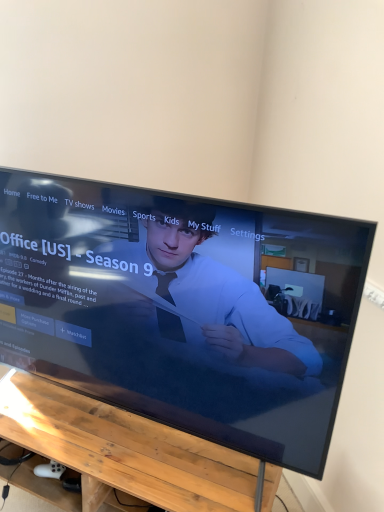
Question: Should I look upward or downward to see wooden table at lower center?

Choices:
 (A) up
 (B) down

Answer: (B)

Question: Is wooden table at lower center looking in the opposite direction of black glossy tv at center?

Choices:
 (A) yes
 (B) no

Answer: (B)

Question: From a real-world perspective, is wooden table at lower center physically above black glossy tv at center?

Choices:
 (A) yes
 (B) no

Answer: (B)

Question: From the image's perspective, is wooden table at lower center below black glossy tv at center?

Choices:
 (A) no
 (B) yes

Answer: (B)

Question: Considering the relative sizes of wooden table at lower center and black glossy tv at center in the image provided, is wooden table at lower center shorter than black glossy tv at center?

Choices:
 (A) yes
 (B) no

Answer: (A)

Question: Does wooden table at lower center appear on the right side of black glossy tv at center?

Choices:
 (A) no
 (B) yes

Answer: (A)

Question: Is wooden table at lower center located outside black glossy tv at center?

Choices:
 (A) no
 (B) yes

Answer: (B)

Question: Could you tell me if black glossy tv at center is turned towards wooden table at lower center?

Choices:
 (A) yes
 (B) no

Answer: (B)

Question: Can you confirm if black glossy tv at center is positioned to the right of wooden table at lower center?

Choices:
 (A) no
 (B) yes

Answer: (B)

Question: Does black glossy tv at center have a smaller size compared to wooden table at lower center?

Choices:
 (A) no
 (B) yes

Answer: (A)

Question: Is black glossy tv at center to the left of wooden table at lower center from the viewer's perspective?

Choices:
 (A) yes
 (B) no

Answer: (B)

Question: Is black glossy tv at center shorter than wooden table at lower center?

Choices:
 (A) yes
 (B) no

Answer: (B)

Question: Is black glossy tv at center next to wooden table at lower center and touching it?

Choices:
 (A) no
 (B) yes

Answer: (A)

Question: Is wooden table at lower center to the left or to the right of black glossy tv at center in the image?

Choices:
 (A) left
 (B) right

Answer: (A)